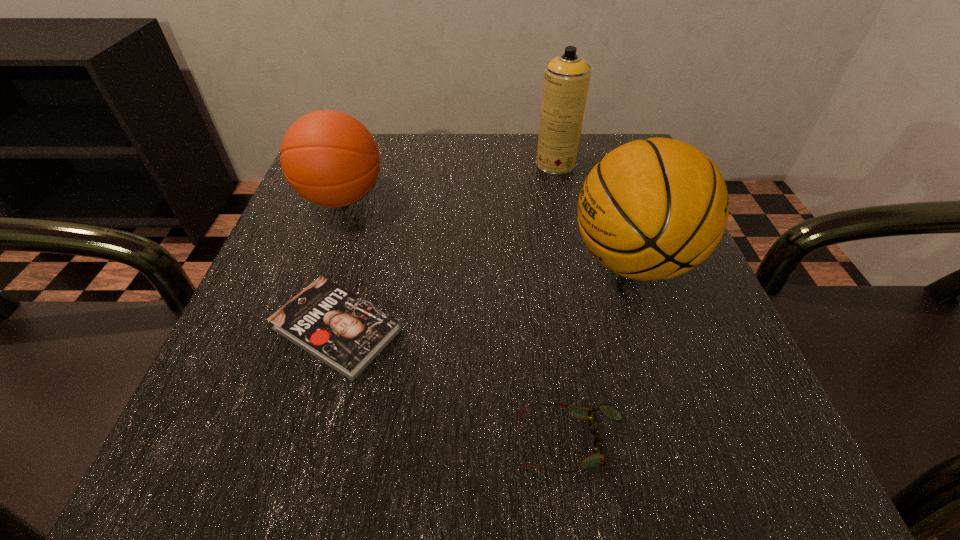
At what (x,y) coordinates should I click in order to perform the action: click on blank space at the near left corner of the desktop. Please return your answer as a coordinate pair (x, y). The width and height of the screenshot is (960, 540). Looking at the image, I should click on (181, 456).

The height and width of the screenshot is (540, 960). In the image, there is a desktop. In order to click on vacant space at the far right corner in this screenshot , I will do `click(588, 146)`.

This screenshot has width=960, height=540. Identify the location of vacant space at the near right corner of the desktop. (727, 448).

This screenshot has width=960, height=540. What are the coordinates of `vacant region between the right basketball and the shorter basketball` in the screenshot? It's located at (487, 230).

Identify the location of vacant space that is in between the second shortest object and the shortest object. This screenshot has height=540, width=960. (454, 386).

Where is `unoccupied position between the taller basketball and the third tallest object`? The height and width of the screenshot is (540, 960). unoccupied position between the taller basketball and the third tallest object is located at coordinates (487, 230).

Identify the location of vacant region between the right basketball and the book. (485, 295).

Find the location of a particular element. The width and height of the screenshot is (960, 540). vacant area between the aerosol can and the third shortest object is located at coordinates (448, 181).

Identify the location of unoccupied position between the shorter basketball and the taller basketball. The width and height of the screenshot is (960, 540). (487, 230).

Identify the location of empty space between the shorter basketball and the aerosol can. (448, 181).